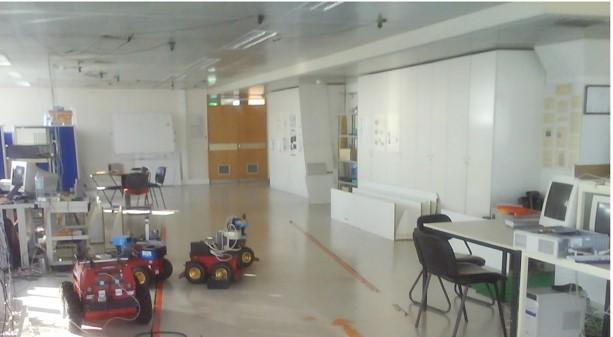
Where is `white board`? The image size is (613, 337). white board is located at coordinates (139, 132).